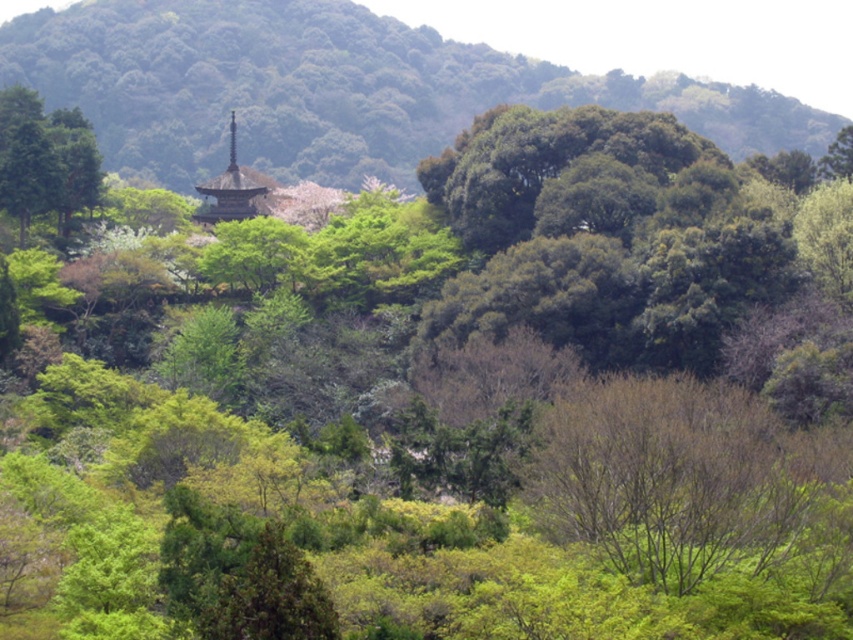
You are an artist sketching the landscape and want to draw the bare branches at center and the dark brown wooden spire at center accurately. Based on their positions, which one should you draw first if you are moving from left to right across the page?

You should draw the dark brown wooden spire at center first because the bare branches at center is to the right of it, so moving left to right, the spire comes before the branches.

You are an artist planning to paint this landscape. You want to emphasize the contrast between the green leafy hillside at upper center and the bare branches at center. Which object should you make larger in your painting to highlight this contrast?

To highlight the contrast between the green leafy hillside at upper center and the bare branches at center, you should make the green leafy hillside at upper center larger since it is already bigger than the bare branches at center in the image.

You are an architect designing a new garden path that needs to pass between the green leafy hillside at upper center and the dark brown wooden spire at center. Considering their sizes, which object will require more space to accommodate in the path design?

The green leafy hillside at upper center is larger in size than the dark brown wooden spire at center, so it will require more space to accommodate in the path design.